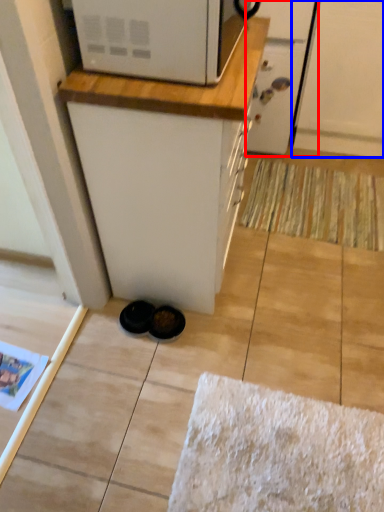
Question: Which object appears farthest to the camera in this image, screen door (highlighted by a red box) or screen door (highlighted by a blue box)?

Choices:
 (A) screen door
 (B) screen door

Answer: (A)